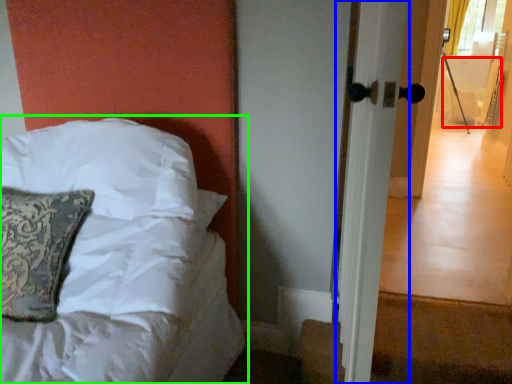
Question: Estimate the real-world distances between objects in this image. Which object is closer to armchair (highlighted by a red box), screen door (highlighted by a blue box) or bed (highlighted by a green box)?

Choices:
 (A) screen door
 (B) bed

Answer: (A)